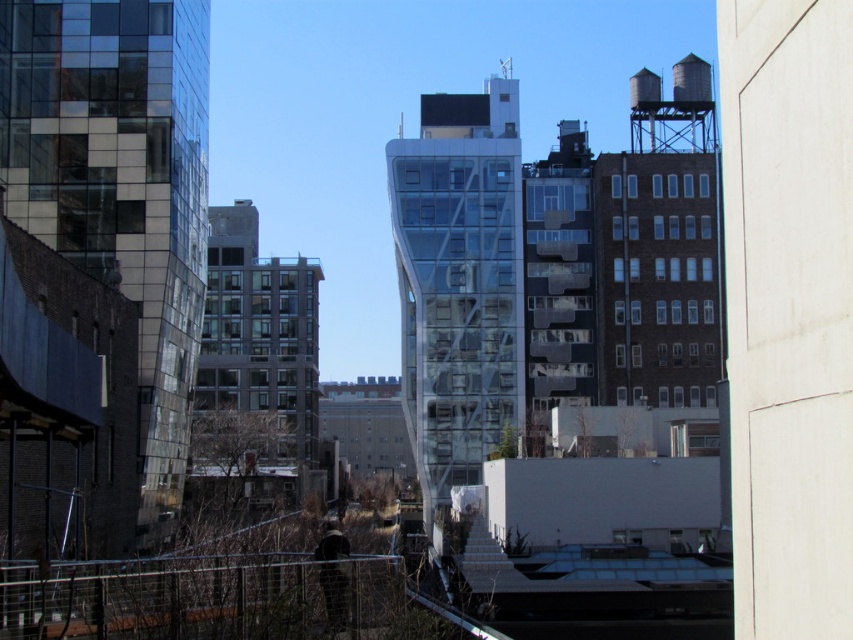
You are a city planner assessing the urban layout. You need to determine if the metallic water tower at center can be moved closer to the metallic wire fence at lower center without overlapping. Based on their widths, can they be positioned side by side in the available space?

The metallic water tower at center is wider than the metallic wire fence at lower center. Since their combined width would require more space than what is available, they cannot be positioned side by side without overlapping.

You are a city planner reviewing this urban area. You need to install a new security camera that can monitor both the metallic water tower at center and the metallic wire fence at lower center. Based on their positions, where should you place the camera to ensure both are visible without obstruction?

The metallic wire fence at lower center is behind the metallic water tower at center, so placing the camera in a position where it can look past the water tower would allow visibility of both. Alternatively, positioning it higher than the water tower might ensure an unobstructed view of the fence behind.

In the scene shown: You are a city planner assessing the space between the metallic water tower at center and the metallic wire fence at lower center. The city requires a minimum safety distance of 70 meters between such structures. Does this distance comply with the regulation?

The distance between the metallic water tower at center and the metallic wire fence at lower center is 76.53 meters, which exceeds the required 70 meters. Therefore, it complies with the safety regulation.